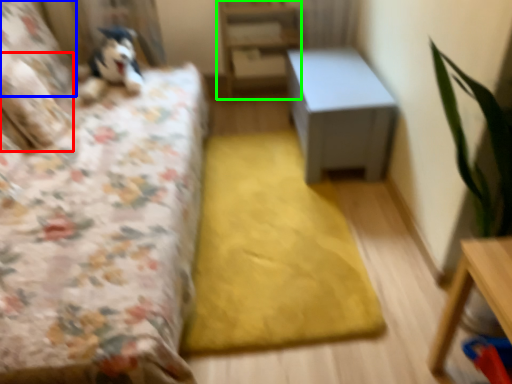
Question: Considering the real-world distances, which object is closest to pillow (highlighted by a red box)? pillow (highlighted by a blue box) or bookshelf (highlighted by a green box).

Choices:
 (A) pillow
 (B) bookshelf

Answer: (A)